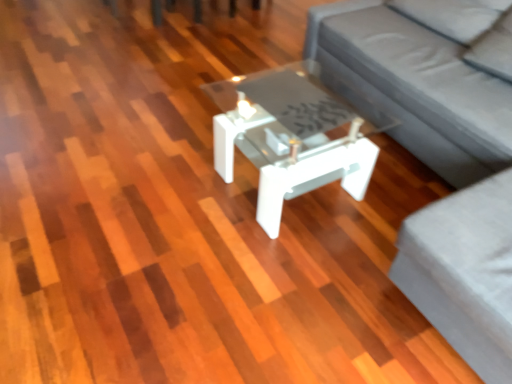
Identify the location of white glossy coffee table at center. This screenshot has height=384, width=512. (295, 134).

Locate an element on the screen. gray fabric couch at center is located at coordinates (418, 86).

Measure the distance between point (422, 95) and camera.

Point (422, 95) is 1.96 meters away from camera.

Find the location of `white glossy coffee table at center`. white glossy coffee table at center is located at coordinates (295, 134).

Identify the location of studio couch located on the right of white glossy coffee table at center. This screenshot has width=512, height=384. (418, 86).

Is gray fabric couch at center in front of or behind white glossy coffee table at center in the image?

Clearly, gray fabric couch at center is in front of white glossy coffee table at center.

Between gray fabric couch at center and white glossy coffee table at center, which one has more height?

Standing taller between the two is gray fabric couch at center.

Can you tell me how much gray fabric couch at center and white glossy coffee table at center differ in facing direction?

0.000353 degrees separate the facing orientations of gray fabric couch at center and white glossy coffee table at center.

Considering the sizes of objects gray fabric couch at center and gray fabric couch at center in the image provided, who is bigger, gray fabric couch at center or gray fabric couch at center?

gray fabric couch at center is bigger.

Can we say gray fabric couch at center lies outside gray fabric couch at center?

Actually, gray fabric couch at center is at least partially inside gray fabric couch at center.

Considering the sizes of gray fabric couch at center and gray fabric couch at center in the image, is gray fabric couch at center taller or shorter than gray fabric couch at center?

In the image, gray fabric couch at center appears to be taller than gray fabric couch at center.

Which object is thinner, white glossy coffee table at center or gray fabric couch at center?

Thinner between the two is white glossy coffee table at center.

Find the location of `coffee table on the left of gray fabric couch at center`. coffee table on the left of gray fabric couch at center is located at coordinates (295, 134).

Is white glossy coffee table at center spatially inside gray fabric couch at center, or outside of it?

white glossy coffee table at center exists entirely within gray fabric couch at center.

Considering the positions of objects white glossy coffee table at center and gray fabric couch at center in the image provided, who is more to the right, white glossy coffee table at center or gray fabric couch at center?

Positioned to the right is gray fabric couch at center.

From the image's perspective, which is below, gray fabric couch at center or white glossy coffee table at center?

white glossy coffee table at center appears lower in the image.

Considering the relative sizes of gray fabric couch at center and white glossy coffee table at center in the image provided, is gray fabric couch at center smaller than white glossy coffee table at center?

No, gray fabric couch at center is not smaller than white glossy coffee table at center.

Considering the positions of objects gray fabric couch at center and white glossy coffee table at center in the image provided, who is more to the left, gray fabric couch at center or white glossy coffee table at center?

white glossy coffee table at center is more to the left.

Locate an element on the screen. The width and height of the screenshot is (512, 384). couch that is above the white glossy coffee table at center (from a real-world perspective) is located at coordinates (418, 86).

Considering the relative sizes of white glossy coffee table at center and gray fabric couch at center in the image provided, is white glossy coffee table at center smaller than gray fabric couch at center?

Yes, white glossy coffee table at center is smaller than gray fabric couch at center.

Is white glossy coffee table at center wider or thinner than gray fabric couch at center?

Considering their sizes, white glossy coffee table at center looks slimmer than gray fabric couch at center.

From a real-world perspective, relative to gray fabric couch at center, is white glossy coffee table at center vertically above or below?

white glossy coffee table at center is situated lower than gray fabric couch at center in the real world.

Is white glossy coffee table at center taller or shorter than gray fabric couch at center?

Considering their sizes, white glossy coffee table at center has less height than gray fabric couch at center.

Is gray fabric couch at center beside gray fabric couch at center?

Yes, gray fabric couch at center is in contact with gray fabric couch at center.

Is gray fabric couch at center looking in the opposite direction of gray fabric couch at center?

Absolutely, gray fabric couch at center is directed away from gray fabric couch at center.

Consider the image. Which of these two, gray fabric couch at center or gray fabric couch at center, is bigger?

With larger size is gray fabric couch at center.

How different are the orientations of gray fabric couch at center and gray fabric couch at center in degrees?

gray fabric couch at center and gray fabric couch at center are facing 0.000108 degrees away from each other.

You are a GUI agent. You are given a task and a screenshot of the screen. Output one action in this format:
    pyautogui.click(x=<x>, y=<y>)
    Task: Click on the studio couch above the white glossy coffee table at center (from the image's perspective)
    
    Given the screenshot: What is the action you would take?
    pyautogui.click(x=418, y=86)

This screenshot has height=384, width=512. Identify the location of couch beneath the gray fabric couch at center (from a real-world perspective). (418, 86).

Based on their spatial positions, is white glossy coffee table at center or gray fabric couch at center closer to gray fabric couch at center?

Among the two, gray fabric couch at center is located nearer to gray fabric couch at center.

In the scene shown: From the image, which object appears to be nearer to gray fabric couch at center, gray fabric couch at center or white glossy coffee table at center?

gray fabric couch at center lies closer to gray fabric couch at center than the other object.

When comparing their distances from white glossy coffee table at center, does gray fabric couch at center or gray fabric couch at center seem closer?

Based on the image, gray fabric couch at center appears to be nearer to white glossy coffee table at center.

When comparing their distances from gray fabric couch at center, does white glossy coffee table at center or gray fabric couch at center seem further?

white glossy coffee table at center lies further to gray fabric couch at center than the other object.

From the image, which object appears to be nearer to gray fabric couch at center, gray fabric couch at center or white glossy coffee table at center?

Based on the image, gray fabric couch at center appears to be nearer to gray fabric couch at center.

When comparing their distances from white glossy coffee table at center, does gray fabric couch at center or gray fabric couch at center seem further?

Among the two, gray fabric couch at center is located further to white glossy coffee table at center.

Where is `studio couch located between white glossy coffee table at center and gray fabric couch at center in the left-right direction`? Image resolution: width=512 pixels, height=384 pixels. studio couch located between white glossy coffee table at center and gray fabric couch at center in the left-right direction is located at coordinates (418, 86).